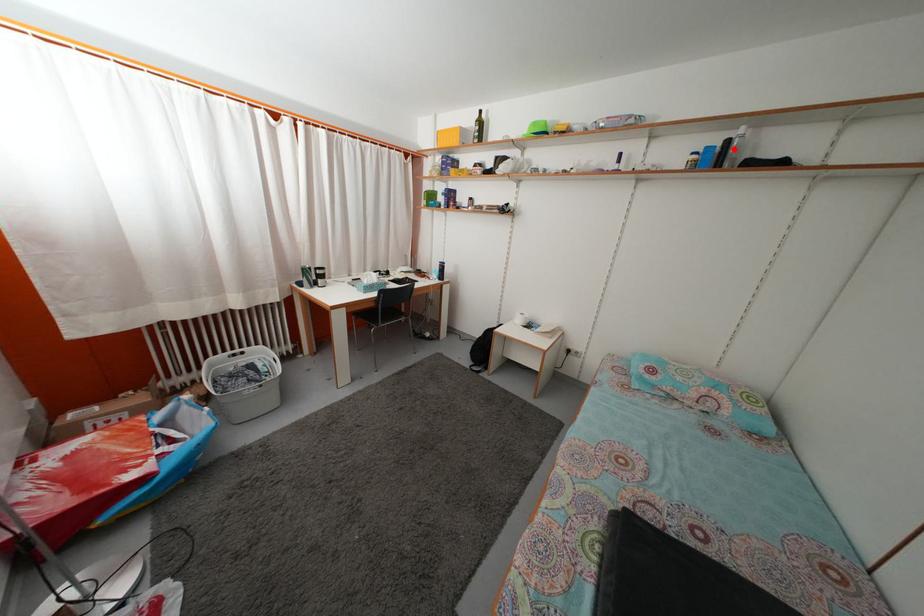
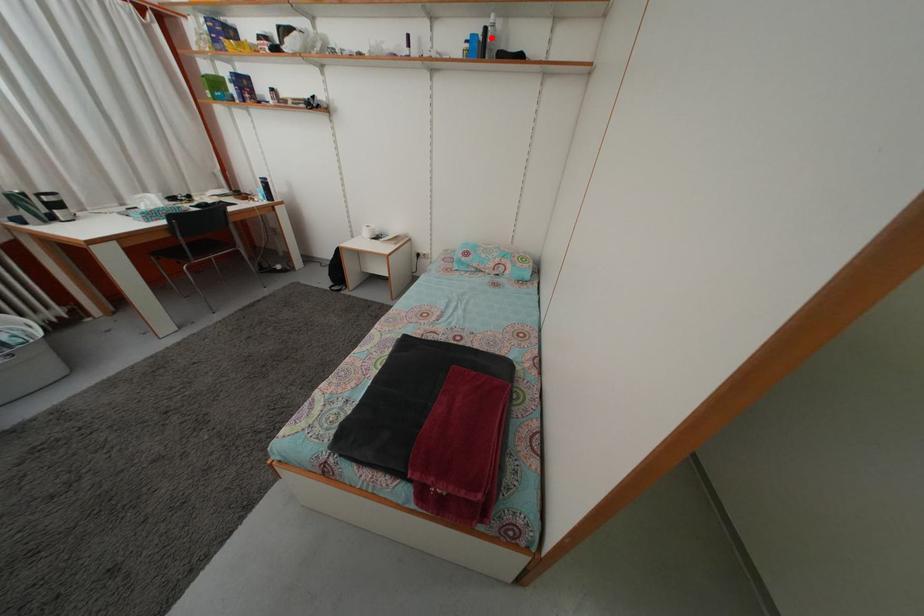
I am providing you with two images of the same scene from different viewpoints. A red point is marked on the first image and another point is marked on the second image. Does the point marked in image1 correspond to the same location as the one in image2?

Yes